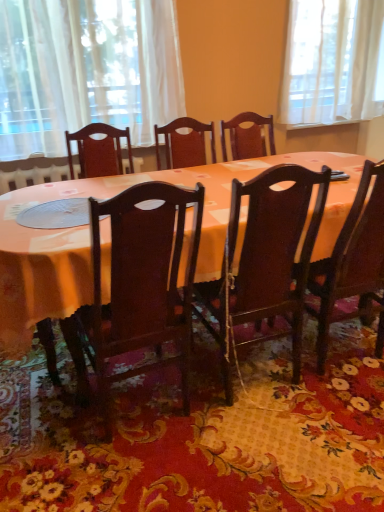
I want to click on vacant space to the right of dark wood chair at center, the 3th chair when ordered from right to left, so click(244, 440).